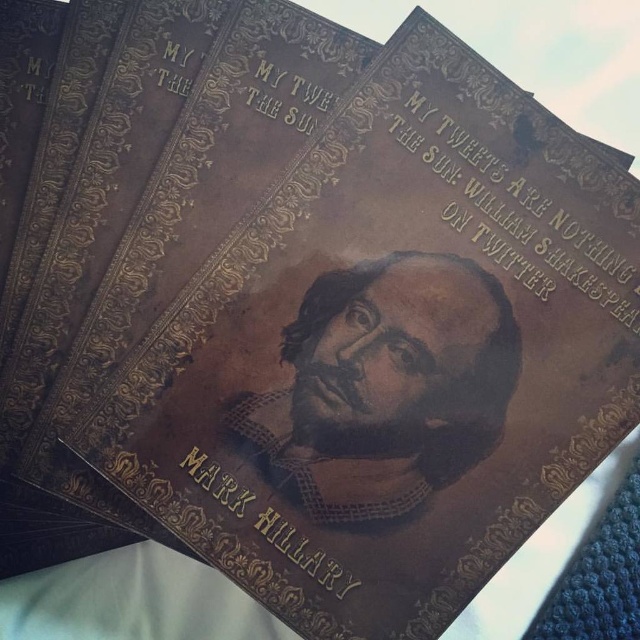
What is located at the coordinates point (385, 387) on the book cover?

The point (385, 387) marks the brown leather portrait at center on the book cover.